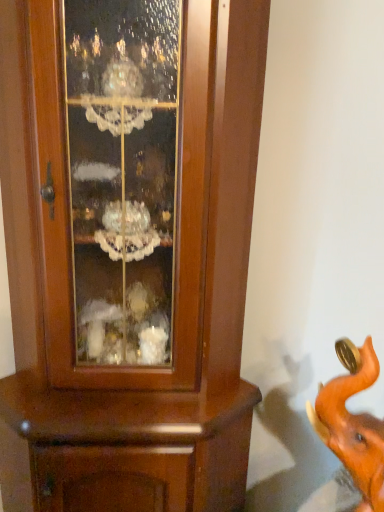
Question: Does orange matte elephant at lower right have a smaller size compared to brown wooden cupboard at center?

Choices:
 (A) no
 (B) yes

Answer: (B)

Question: Is the position of orange matte elephant at lower right less distant than that of brown wooden cupboard at center?

Choices:
 (A) yes
 (B) no

Answer: (A)

Question: Is orange matte elephant at lower right wider than brown wooden cupboard at center?

Choices:
 (A) yes
 (B) no

Answer: (B)

Question: Is orange matte elephant at lower right turned away from brown wooden cupboard at center?

Choices:
 (A) no
 (B) yes

Answer: (A)

Question: Does orange matte elephant at lower right have a lesser width compared to brown wooden cupboard at center?

Choices:
 (A) no
 (B) yes

Answer: (B)

Question: From a real-world perspective, is orange matte elephant at lower right located higher than brown wooden cupboard at center?

Choices:
 (A) no
 (B) yes

Answer: (B)

Question: Does brown wooden cupboard at center have a greater height compared to orange matte elephant at lower right?

Choices:
 (A) yes
 (B) no

Answer: (A)

Question: Can you confirm if brown wooden cupboard at center is positioned to the right of orange matte elephant at lower right?

Choices:
 (A) no
 (B) yes

Answer: (A)

Question: Is brown wooden cupboard at center turned away from orange matte elephant at lower right?

Choices:
 (A) yes
 (B) no

Answer: (B)

Question: Is brown wooden cupboard at center not near orange matte elephant at lower right?

Choices:
 (A) yes
 (B) no

Answer: (B)

Question: From a real-world perspective, is brown wooden cupboard at center below orange matte elephant at lower right?

Choices:
 (A) no
 (B) yes

Answer: (B)

Question: Can you confirm if brown wooden cupboard at center is bigger than orange matte elephant at lower right?

Choices:
 (A) no
 (B) yes

Answer: (B)

Question: From a real-world perspective, is brown wooden cupboard at center physically located above or below orange matte elephant at lower right?

Choices:
 (A) below
 (B) above

Answer: (A)